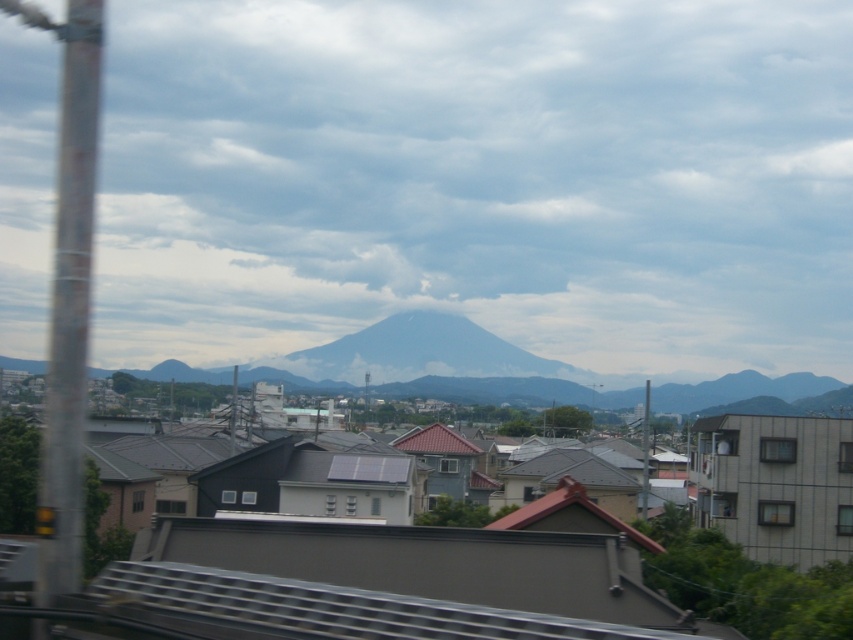
This screenshot has height=640, width=853. What are the coordinates of `cloudy sky at center` in the screenshot? It's located at (480, 179).

Who is taller, cloudy sky at center or white snow-capped mountain at center?

cloudy sky at center

Between point (654, 208) and point (477, 387), which one is positioned in front?

Point (477, 387) is in front.

The height and width of the screenshot is (640, 853). I want to click on cloudy sky at center, so click(x=480, y=179).

Which is behind, point (685, 218) or point (369, 340)?

Positioned behind is point (685, 218).

In the scene shown: Who is taller, cloudy sky at center or white snow-covered mountain at center?

cloudy sky at center is taller.

Where is `cloudy sky at center`? cloudy sky at center is located at coordinates pos(480,179).

Who is more forward, [76,236] or [396,348]?

Positioned in front is point [76,236].

Is metallic gray pole at left above white snow-covered mountain at center?

Correct, metallic gray pole at left is located above white snow-covered mountain at center.

What do you see at coordinates (68, 307) in the screenshot?
I see `metallic gray pole at left` at bounding box center [68, 307].

Locate an element on the screen. This screenshot has height=640, width=853. metallic gray pole at left is located at coordinates (68, 307).